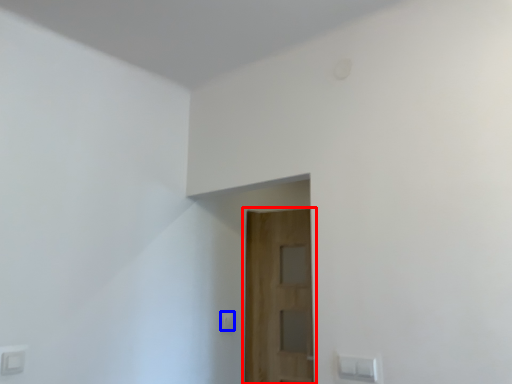
Question: Which of the following is the farthest to the observer, door (highlighted by a red box) or light switch (highlighted by a blue box)?

Choices:
 (A) door
 (B) light switch

Answer: (B)